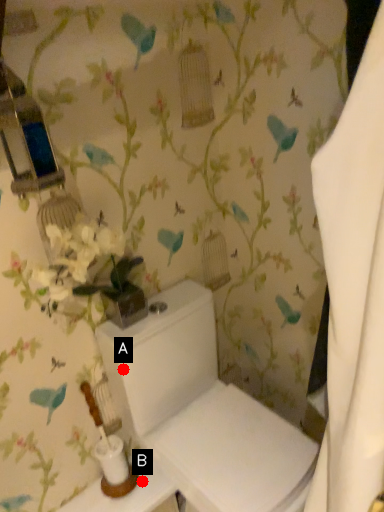
Question: Two points are circled on the image, labeled by A and B beside each circle. Which point is closer to the camera taking this photo?

Choices:
 (A) A is closer
 (B) B is closer

Answer: (A)